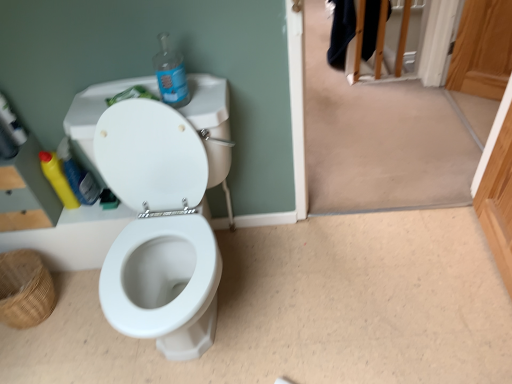
In order to click on vacant region to the right of white glossy toilet at center in this screenshot , I will do `click(316, 299)`.